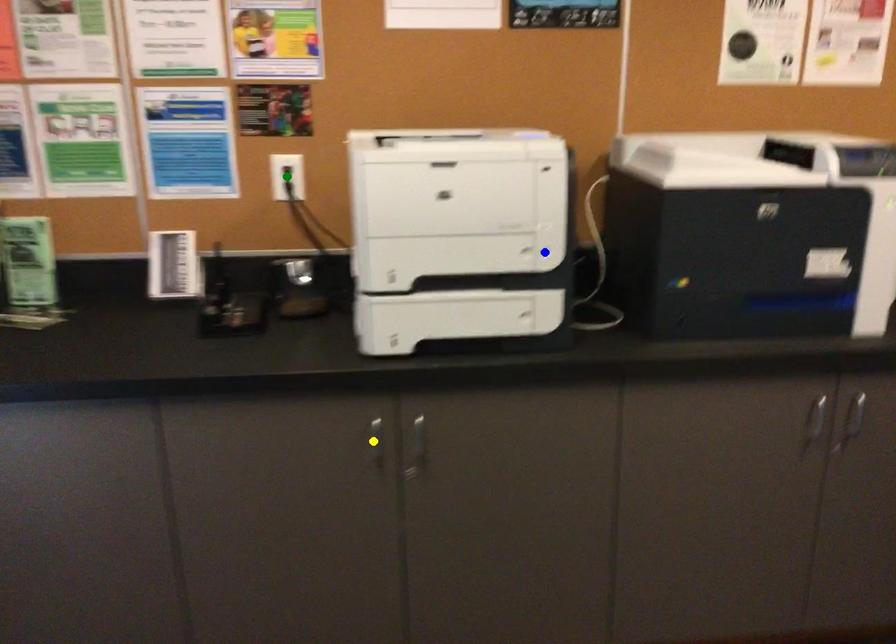
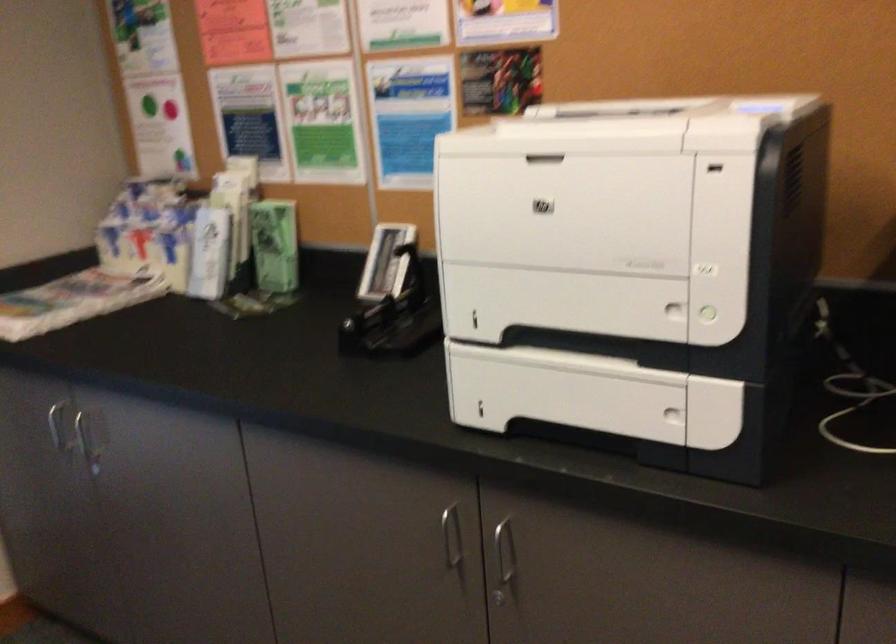
I am providing you with two images of the same scene from different viewpoints. Three points are marked in image1. Which point corresponds to a part or object that is occluded in image2?In image1, three points are marked. Which of them correspond to a part or object that is occluded in image2?Among the three points shown in image1, which one corresponds to a part or object that is no longer visible due to occlusion in image2?

green point cannot be seen in image2.